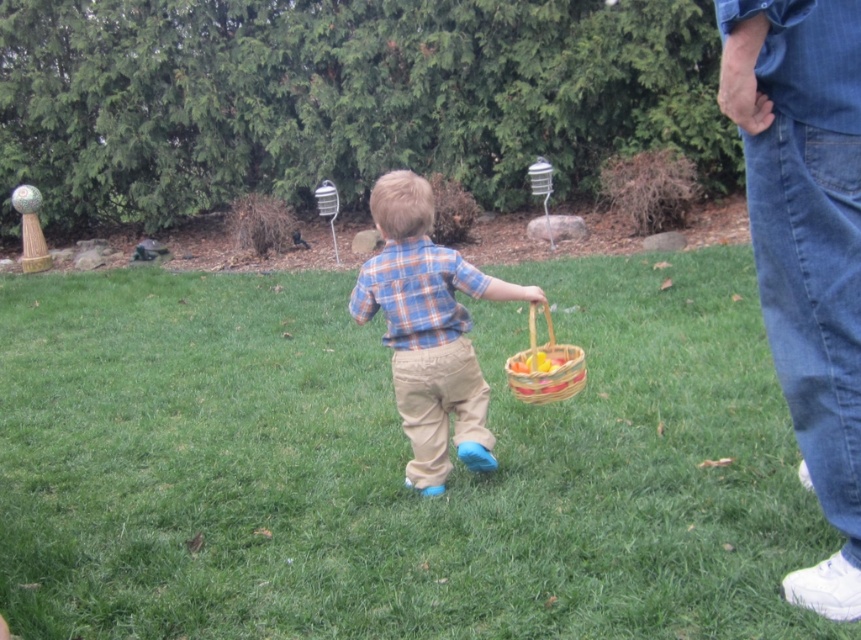
Is point (443, 289) behind point (570, 356)?

No.

Which is in front, point (401, 248) or point (508, 381)?

Point (401, 248) is more forward.

Who is more distant from viewer, (407, 349) or (524, 358)?

Positioned behind is point (524, 358).

You are a GUI agent. You are given a task and a screenshot of the screen. Output one action in this format:
    pyautogui.click(x=<x>, y=<y>)
    Task: Click on the plaid shirt at center
    The image size is (861, 640).
    Given the screenshot: What is the action you would take?
    pyautogui.click(x=428, y=330)

The height and width of the screenshot is (640, 861). Describe the element at coordinates (394, 465) in the screenshot. I see `green grass at center` at that location.

Is green grass at center above woven wood basket at center?

Actually, green grass at center is below woven wood basket at center.

Who is more forward, (267, 531) or (512, 368)?

Point (267, 531) is more forward.

This screenshot has width=861, height=640. Find the location of `green grass at center`. green grass at center is located at coordinates (394, 465).

Between green grass at center and denim jeans at right, which one is positioned higher?

denim jeans at right

You are a GUI agent. You are given a task and a screenshot of the screen. Output one action in this format:
    pyautogui.click(x=<x>, y=<y>)
    Task: Click on the green grass at center
    The height and width of the screenshot is (640, 861).
    Given the screenshot: What is the action you would take?
    pyautogui.click(x=394, y=465)

Identify the location of green grass at center. This screenshot has height=640, width=861. (394, 465).

At what (x,y) coordinates should I click in order to perform the action: click on green grass at center. Please return your answer as a coordinate pair (x, y). The width and height of the screenshot is (861, 640). Looking at the image, I should click on (394, 465).